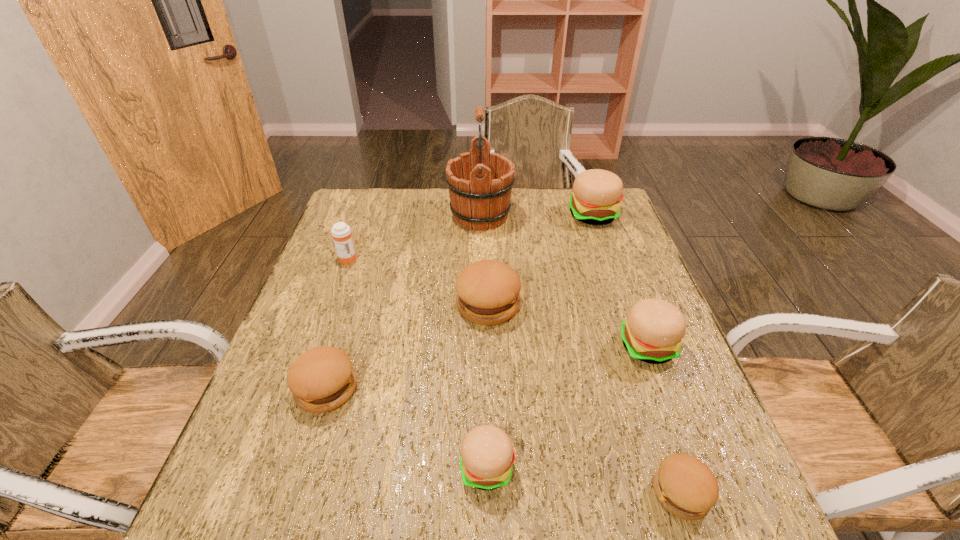
Identify the location of wood wine bucket. (480, 183).

Identify the location of the tallest object. The height and width of the screenshot is (540, 960). click(480, 183).

Identify the location of the farthest beige hamburger. This screenshot has height=540, width=960. (597, 193).

Identify the location of the tallest hamburger. (597, 193).

Where is `medicine`? The width and height of the screenshot is (960, 540). medicine is located at coordinates (341, 233).

What are the coordinates of `orange medicine` in the screenshot? It's located at (341, 233).

Find the location of a particular element. This screenshot has width=960, height=540. the second nearest beige hamburger is located at coordinates (653, 331).

Image resolution: width=960 pixels, height=540 pixels. I want to click on the farthest brown hamburger, so click(x=488, y=291).

Locate an element on the screen. The width and height of the screenshot is (960, 540). the biggest brown hamburger is located at coordinates (488, 291).

Where is `the second nearest brown hamburger`? This screenshot has height=540, width=960. the second nearest brown hamburger is located at coordinates (321, 379).